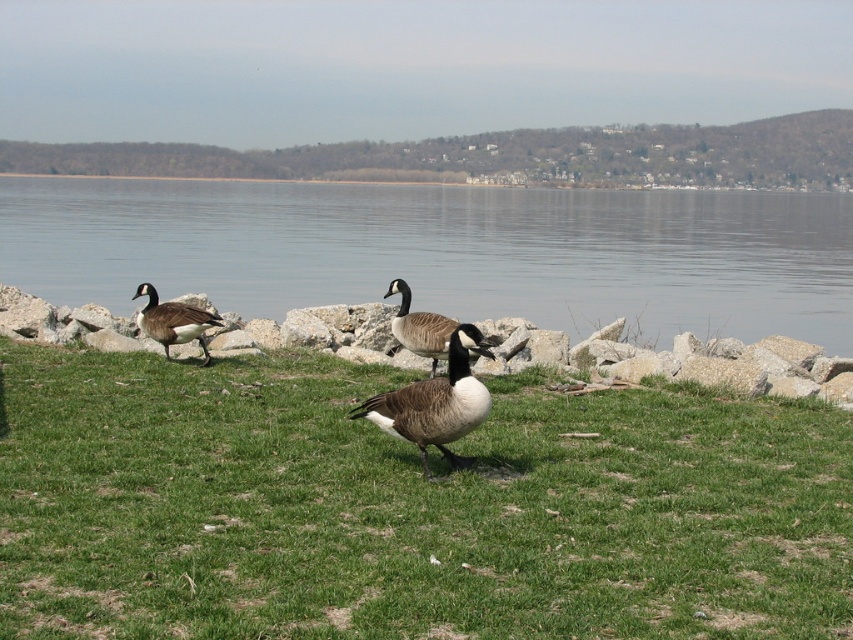
Can you confirm if gray rock at center is positioned above white glossy duck at center?

Correct, gray rock at center is located above white glossy duck at center.

Which of these two, gray rock at center or white glossy duck at center, stands shorter?

Standing shorter between the two is white glossy duck at center.

Between point (608, 346) and point (460, 385), which one is positioned in front?

Point (460, 385) is in front.

Identify the location of gray rock at center. (735, 369).

Is point (306, 456) closer to viewer compared to point (390, 403)?

No.

Can you confirm if green grass at center is shorter than white glossy duck at center?

Indeed, green grass at center has a lesser height compared to white glossy duck at center.

Between point (131, 618) and point (405, 420), which one is positioned behind?

Positioned behind is point (405, 420).

You are a GUI agent. You are given a task and a screenshot of the screen. Output one action in this format:
    pyautogui.click(x=<x>, y=<y>)
    Task: Click on the green grass at center
    The height and width of the screenshot is (640, 853).
    Given the screenshot: What is the action you would take?
    pyautogui.click(x=407, y=508)

Based on the photo, between gray rock at center and brown speckled goose at center, which one is positioned lower?

brown speckled goose at center is lower down.

How distant is gray rock at center from brown speckled goose at center?

gray rock at center is 2.77 meters away from brown speckled goose at center.

I want to click on gray rock at center, so click(735, 369).

The image size is (853, 640). What are the coordinates of `gray rock at center` in the screenshot? It's located at (735, 369).